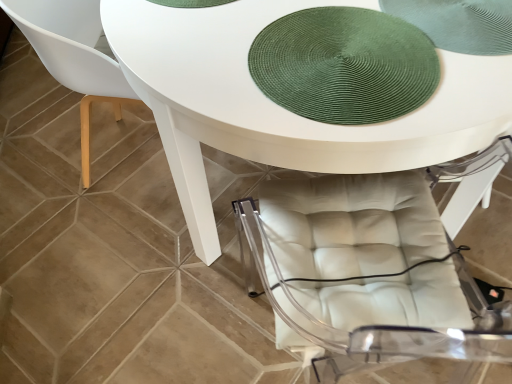
Question: Should I look upward or downward to see white glossy table at center?

Choices:
 (A) up
 (B) down

Answer: (A)

Question: From a real-world perspective, is matte white chair at lower left positioned over green woven mat at upper center based on gravity?

Choices:
 (A) yes
 (B) no

Answer: (B)

Question: Would you say matte white chair at lower left is outside green woven mat at upper center?

Choices:
 (A) no
 (B) yes

Answer: (B)

Question: Can you see matte white chair at lower left touching green woven mat at upper center?

Choices:
 (A) no
 (B) yes

Answer: (A)

Question: Does matte white chair at lower left have a lesser height compared to green woven mat at upper center?

Choices:
 (A) no
 (B) yes

Answer: (A)

Question: From the image's perspective, is matte white chair at lower left under green woven mat at upper center?

Choices:
 (A) no
 (B) yes

Answer: (A)

Question: Is matte white chair at lower left looking in the opposite direction of green woven mat at upper center?

Choices:
 (A) no
 (B) yes

Answer: (A)

Question: Is matte white chair at lower left turned away from white glossy table at center?

Choices:
 (A) yes
 (B) no

Answer: (B)

Question: Is white glossy table at center completely or partially inside matte white chair at lower left?

Choices:
 (A) no
 (B) yes

Answer: (A)

Question: Can you confirm if matte white chair at lower left is smaller than white glossy table at center?

Choices:
 (A) no
 (B) yes

Answer: (B)

Question: Are matte white chair at lower left and white glossy table at center making contact?

Choices:
 (A) yes
 (B) no

Answer: (B)

Question: Is matte white chair at lower left bigger than white glossy table at center?

Choices:
 (A) yes
 (B) no

Answer: (B)

Question: Does matte white chair at lower left have a greater width compared to white glossy table at center?

Choices:
 (A) yes
 (B) no

Answer: (B)

Question: Can matte white chair at lower left be found inside green woven mat at upper center?

Choices:
 (A) no
 (B) yes

Answer: (A)